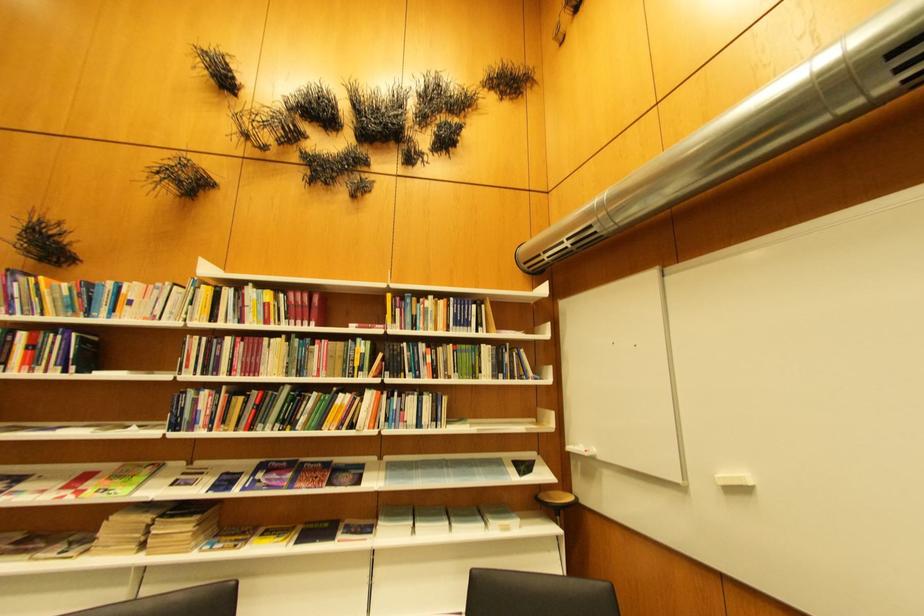
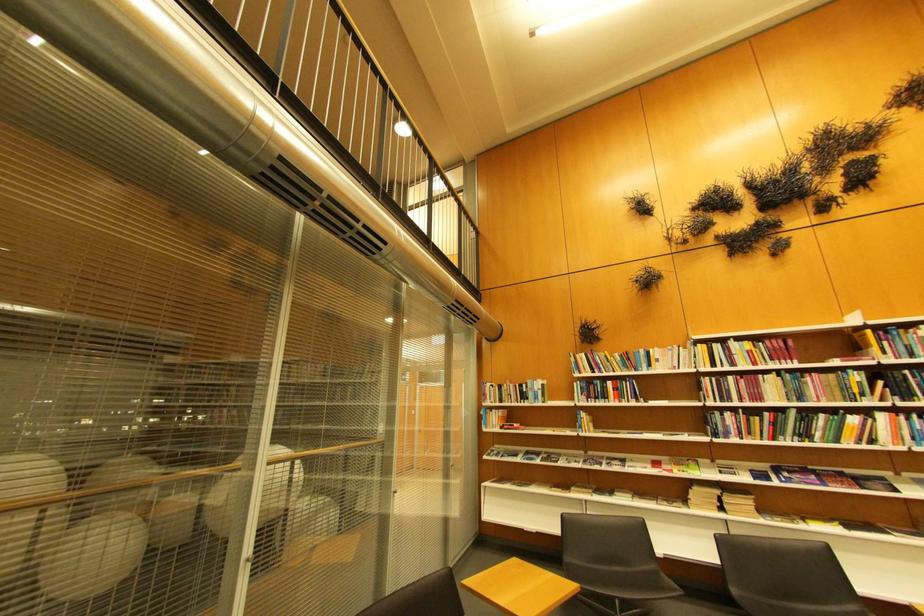
The point at [297,391] is marked in the first image. Where is the corresponding point in the second image?

(804, 413)